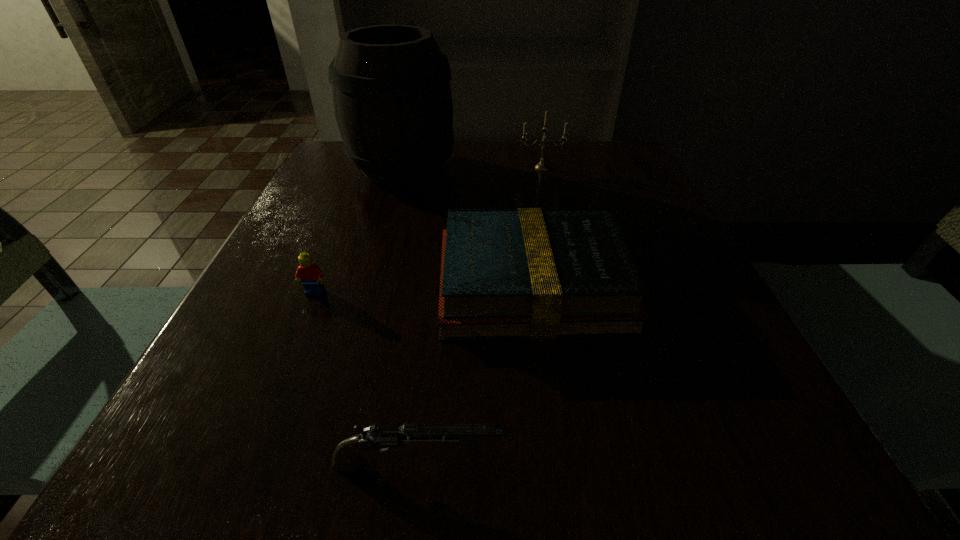
At what (x,y) coordinates should I click in order to perform the action: click on the tallest object. Please return your answer as a coordinate pair (x, y). Looking at the image, I should click on (392, 99).

Locate an element on the screen. Image resolution: width=960 pixels, height=540 pixels. the fourth shortest object is located at coordinates point(541,166).

The width and height of the screenshot is (960, 540). In order to click on hardback book in this screenshot , I will do `click(529, 273)`.

Where is `Lego`? The width and height of the screenshot is (960, 540). Lego is located at coordinates (310, 274).

The image size is (960, 540). What are the coordinates of `gun` in the screenshot? It's located at (380, 437).

This screenshot has width=960, height=540. I want to click on vacant space situated 0.300m on the right of the wine bucket, so click(x=580, y=170).

Identify the location of free space located on the front of the fourth shortest object. (557, 233).

Where is `blank space located 0.120m on the front of the hardback book`? blank space located 0.120m on the front of the hardback book is located at coordinates (549, 413).

Locate an element on the screen. This screenshot has width=960, height=540. free spot located on the face of the Lego is located at coordinates (241, 471).

Identify the location of blank space located aiming along the barrel of the gun. This screenshot has width=960, height=540. (660, 464).